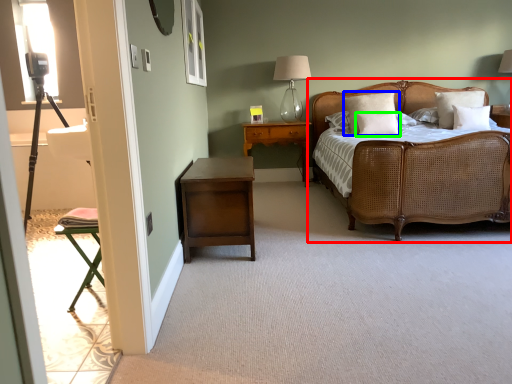
Question: Estimate the real-world distances between objects in this image. Which object is closer to bed (highlighted by a red box), pillow (highlighted by a blue box) or pillow (highlighted by a green box)?

Choices:
 (A) pillow
 (B) pillow

Answer: (B)